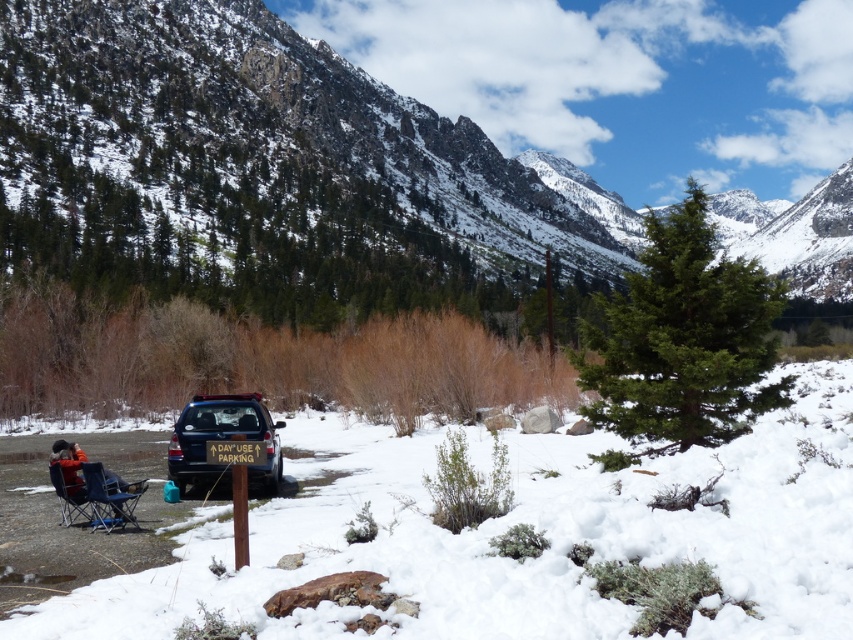
Who is positioned more to the left, snowy rocky mountain at upper center or orange fleece jacket at lower left?

orange fleece jacket at lower left is more to the left.

Does snowy rocky mountain at upper center appear over orange fleece jacket at lower left?

Indeed, snowy rocky mountain at upper center is positioned over orange fleece jacket at lower left.

Which is behind, point (131, 35) or point (93, 486)?

The point (131, 35) is behind.

Image resolution: width=853 pixels, height=640 pixels. I want to click on snowy rocky mountain at upper center, so click(265, 170).

From the picture: Who is shorter, orange fleece jacket at lower left or matte blue folding chair at lower left?

matte blue folding chair at lower left is shorter.

What do you see at coordinates (91, 488) in the screenshot?
I see `orange fleece jacket at lower left` at bounding box center [91, 488].

Where is `orange fleece jacket at lower left`? The width and height of the screenshot is (853, 640). orange fleece jacket at lower left is located at coordinates (91, 488).

Between point (254, 436) and point (55, 486), which one is positioned in front?

Positioned in front is point (55, 486).

Does matte black suv at center appear over matte blue folding chair at lower left?

Yes.

Is point (210, 433) positioned before point (62, 496)?

No, (210, 433) is behind (62, 496).

Locate an element on the screen. This screenshot has height=640, width=853. matte black suv at center is located at coordinates tap(224, 438).